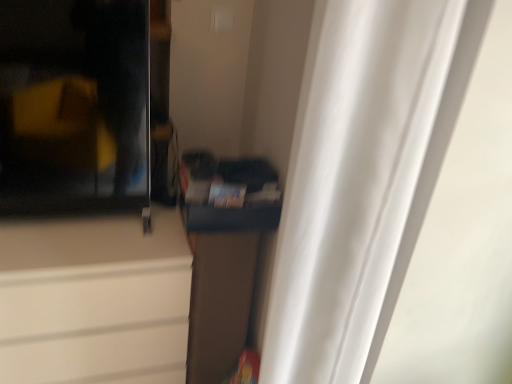
Measure the distance between matte white cabinet at left, which ranks as the second cabinetry in right-to-left order, and camera.

They are 3.97 feet apart.

Identify the location of transparent glass screen door at upper left. (74, 107).

Where is `matte white cabinet at left, which ranks as the second cabinetry in right-to-left order`? The width and height of the screenshot is (512, 384). matte white cabinet at left, which ranks as the second cabinetry in right-to-left order is located at coordinates (94, 300).

Which of these two, white sheer curtain at right or matte white cabinet at left, acting as the first cabinetry starting from the left, is wider?

matte white cabinet at left, acting as the first cabinetry starting from the left, is wider.

Based on the photo, is white sheer curtain at right directly adjacent to matte white cabinet at left, acting as the first cabinetry starting from the left?

No, white sheer curtain at right is not touching matte white cabinet at left, acting as the first cabinetry starting from the left.

How different are the orientations of white sheer curtain at right and matte white cabinet at left, acting as the first cabinetry starting from the left, in degrees?

The facing directions of white sheer curtain at right and matte white cabinet at left, acting as the first cabinetry starting from the left, are 89.8 degrees apart.

Which object is positioned more to the right, white sheer curtain at right or matte white cabinet at left, which ranks as the second cabinetry in right-to-left order?

Positioned to the right is white sheer curtain at right.

Is transparent glass screen door at upper left positioned beyond the bounds of brown fabric cabinet at center, which is the second cabinetry from left to right?

transparent glass screen door at upper left lies outside brown fabric cabinet at center, which is the second cabinetry from left to right,'s area.

Does point (35, 151) come in front of point (197, 261)?

Yes.

Who is bigger, transparent glass screen door at upper left or brown fabric cabinet at center, positioned as the first cabinetry in right-to-left order?

With larger size is brown fabric cabinet at center, positioned as the first cabinetry in right-to-left order.

Considering the relative sizes of transparent glass screen door at upper left and brown fabric cabinet at center, which is the second cabinetry from left to right, in the image provided, is transparent glass screen door at upper left taller than brown fabric cabinet at center, which is the second cabinetry from left to right,?

No.

Between matte white cabinet at left, acting as the first cabinetry starting from the left, and brown fabric cabinet at center, which is the second cabinetry from left to right, which one has smaller width?

brown fabric cabinet at center, which is the second cabinetry from left to right, is thinner.

Who is more distant, matte white cabinet at left, which ranks as the second cabinetry in right-to-left order, or brown fabric cabinet at center, which is the second cabinetry from left to right?

brown fabric cabinet at center, which is the second cabinetry from left to right, is behind.

Is matte white cabinet at left, acting as the first cabinetry starting from the left, inside the boundaries of brown fabric cabinet at center, positioned as the first cabinetry in right-to-left order, or outside?

matte white cabinet at left, acting as the first cabinetry starting from the left, is outside brown fabric cabinet at center, positioned as the first cabinetry in right-to-left order.

Can you confirm if matte white cabinet at left, which ranks as the second cabinetry in right-to-left order, is bigger than brown fabric cabinet at center, which is the second cabinetry from left to right?

Yes.

Find the location of a particular element. The height and width of the screenshot is (384, 512). curtain above the matte white cabinet at left, which ranks as the second cabinetry in right-to-left order (from the image's perspective) is located at coordinates (362, 177).

Considering the sizes of objects matte white cabinet at left, which ranks as the second cabinetry in right-to-left order, and white sheer curtain at right in the image provided, who is taller, matte white cabinet at left, which ranks as the second cabinetry in right-to-left order, or white sheer curtain at right?

Standing taller between the two is white sheer curtain at right.

Does matte white cabinet at left, which ranks as the second cabinetry in right-to-left order, touch white sheer curtain at right?

No, matte white cabinet at left, which ranks as the second cabinetry in right-to-left order, is not touching white sheer curtain at right.

Considering the sizes of objects matte white cabinet at left, which ranks as the second cabinetry in right-to-left order, and white sheer curtain at right in the image provided, who is thinner, matte white cabinet at left, which ranks as the second cabinetry in right-to-left order, or white sheer curtain at right?

With smaller width is white sheer curtain at right.

From the image's perspective, is matte white cabinet at left, which ranks as the second cabinetry in right-to-left order, over transparent glass screen door at upper left?

No.

Does matte white cabinet at left, which ranks as the second cabinetry in right-to-left order, lie behind transparent glass screen door at upper left?

Yes.

You are a GUI agent. You are given a task and a screenshot of the screen. Output one action in this format:
    pyautogui.click(x=<x>, y=<y>)
    Task: Click on the 1st cabinetry behind the transparent glass screen door at upper left, counting from the anchor's position
    The width and height of the screenshot is (512, 384).
    Given the screenshot: What is the action you would take?
    pyautogui.click(x=94, y=300)

In terms of size, does matte white cabinet at left, acting as the first cabinetry starting from the left, appear bigger or smaller than transparent glass screen door at upper left?

matte white cabinet at left, acting as the first cabinetry starting from the left, is bigger than transparent glass screen door at upper left.

From a real-world perspective, relative to matte white cabinet at left, which ranks as the second cabinetry in right-to-left order, is brown fabric cabinet at center, which is the second cabinetry from left to right, vertically above or below?

From a real-world perspective, brown fabric cabinet at center, which is the second cabinetry from left to right, is physically above matte white cabinet at left, which ranks as the second cabinetry in right-to-left order.

Measure the distance from brown fabric cabinet at center, positioned as the first cabinetry in right-to-left order, to matte white cabinet at left, acting as the first cabinetry starting from the left.

brown fabric cabinet at center, positioned as the first cabinetry in right-to-left order, and matte white cabinet at left, acting as the first cabinetry starting from the left, are 10.50 inches apart from each other.

Are brown fabric cabinet at center, positioned as the first cabinetry in right-to-left order, and matte white cabinet at left, which ranks as the second cabinetry in right-to-left order, located far from each other?

No.

From the image's perspective, which is below, brown fabric cabinet at center, which is the second cabinetry from left to right, or matte white cabinet at left, which ranks as the second cabinetry in right-to-left order?

matte white cabinet at left, which ranks as the second cabinetry in right-to-left order, is shown below in the image.

Is transparent glass screen door at upper left facing towards white sheer curtain at right?

No, transparent glass screen door at upper left is not aimed at white sheer curtain at right.

Is the depth of transparent glass screen door at upper left less than that of white sheer curtain at right?

No, transparent glass screen door at upper left is behind white sheer curtain at right.

From a real-world perspective, is transparent glass screen door at upper left above or below white sheer curtain at right?

Clearly, from a real-world perspective, transparent glass screen door at upper left is above white sheer curtain at right.

Considering the relative sizes of transparent glass screen door at upper left and white sheer curtain at right in the image provided, is transparent glass screen door at upper left smaller than white sheer curtain at right?

Yes, transparent glass screen door at upper left is smaller than white sheer curtain at right.

You are a GUI agent. You are given a task and a screenshot of the screen. Output one action in this format:
    pyautogui.click(x=<x>, y=<y>)
    Task: Click on the 2nd cabinetry below the white sheer curtain at right (from the image's perspective)
    
    Given the screenshot: What is the action you would take?
    pyautogui.click(x=94, y=300)

This screenshot has width=512, height=384. I want to click on screen door above the brown fabric cabinet at center, which is the second cabinetry from left to right (from a real-world perspective), so click(x=74, y=107).

Based on their spatial positions, is transparent glass screen door at upper left or brown fabric cabinet at center, which is the second cabinetry from left to right, closer to white sheer curtain at right?

The object closer to white sheer curtain at right is brown fabric cabinet at center, which is the second cabinetry from left to right.

From the picture: Estimate the real-world distances between objects in this image. Which object is further from brown fabric cabinet at center, positioned as the first cabinetry in right-to-left order, transparent glass screen door at upper left or white sheer curtain at right?

white sheer curtain at right lies further to brown fabric cabinet at center, positioned as the first cabinetry in right-to-left order, than the other object.

From the image, which object appears to be farther from matte white cabinet at left, which ranks as the second cabinetry in right-to-left order, brown fabric cabinet at center, positioned as the first cabinetry in right-to-left order, or white sheer curtain at right?

Among the two, white sheer curtain at right is located further to matte white cabinet at left, which ranks as the second cabinetry in right-to-left order.

From the image, which object appears to be farther from matte white cabinet at left, which ranks as the second cabinetry in right-to-left order, transparent glass screen door at upper left or brown fabric cabinet at center, which is the second cabinetry from left to right?

transparent glass screen door at upper left is positioned further to the anchor matte white cabinet at left, which ranks as the second cabinetry in right-to-left order.

Looking at the image, which one is located closer to white sheer curtain at right, matte white cabinet at left, acting as the first cabinetry starting from the left, or brown fabric cabinet at center, positioned as the first cabinetry in right-to-left order?

brown fabric cabinet at center, positioned as the first cabinetry in right-to-left order.

Considering their positions, is white sheer curtain at right positioned further to transparent glass screen door at upper left than brown fabric cabinet at center, positioned as the first cabinetry in right-to-left order?

Among the two, white sheer curtain at right is located further to transparent glass screen door at upper left.

In the scene shown: Looking at the image, which one is located further to white sheer curtain at right, brown fabric cabinet at center, positioned as the first cabinetry in right-to-left order, or transparent glass screen door at upper left?

transparent glass screen door at upper left is positioned further to the anchor white sheer curtain at right.

From the image, which object appears to be farther from matte white cabinet at left, which ranks as the second cabinetry in right-to-left order, white sheer curtain at right or transparent glass screen door at upper left?

white sheer curtain at right is positioned further to the anchor matte white cabinet at left, which ranks as the second cabinetry in right-to-left order.

Find the location of `cabinetry between transparent glass screen door at upper left and matte white cabinet at left, acting as the first cabinetry starting from the left, from top to bottom`. cabinetry between transparent glass screen door at upper left and matte white cabinet at left, acting as the first cabinetry starting from the left, from top to bottom is located at coordinates (224, 257).

Identify the location of screen door between matte white cabinet at left, acting as the first cabinetry starting from the left, and white sheer curtain at right from left to right. Image resolution: width=512 pixels, height=384 pixels. (74, 107).

You are a GUI agent. You are given a task and a screenshot of the screen. Output one action in this format:
    pyautogui.click(x=<x>, y=<y>)
    Task: Click on the cabinetry located between white sheer curtain at right and brown fabric cabinet at center, which is the second cabinetry from left to right, in the depth direction
    
    Given the screenshot: What is the action you would take?
    pyautogui.click(x=94, y=300)

Locate an element on the screen. Image resolution: width=512 pixels, height=384 pixels. screen door between white sheer curtain at right and brown fabric cabinet at center, which is the second cabinetry from left to right, from front to back is located at coordinates (74, 107).